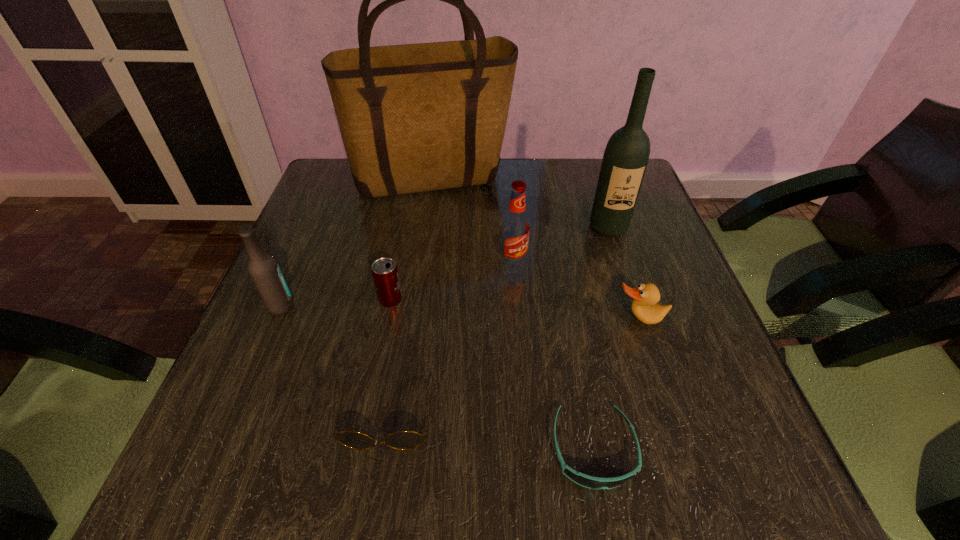
Where is `the right sunglasses`? This screenshot has width=960, height=540. the right sunglasses is located at coordinates (584, 480).

Find the location of a particular element. Image resolution: width=960 pixels, height=540 pixels. the sixth object from left to right is located at coordinates pos(584,480).

Identify the location of vacant region located on the front of the tote bag. The image size is (960, 540). (420, 270).

Image resolution: width=960 pixels, height=540 pixels. Identify the location of vacant space located 0.150m on the labeled side of the wine bottle. (627, 286).

Identify the location of vacant space located on the right of the third farthest object. This screenshot has width=960, height=540. (679, 264).

Where is `free region located 0.370m on the label of the leftmost object`? This screenshot has width=960, height=540. free region located 0.370m on the label of the leftmost object is located at coordinates (476, 306).

Where is `free region located 0.330m on the right of the beer can`? free region located 0.330m on the right of the beer can is located at coordinates (564, 300).

You are a GUI agent. You are given a task and a screenshot of the screen. Output one action in this format:
    pyautogui.click(x=<x>, y=<y>)
    Task: Click on the vacant space situated on the beak of the duck
    This screenshot has height=540, width=960.
    Given the screenshot: What is the action you would take?
    coord(659,377)

At what (x,y) coordinates should I click in order to perform the action: click on free space located on the lenses of the left sunglasses. Please return your answer as a coordinate pair (x, y). Looking at the image, I should click on (375, 494).

Locate an element on the screen. object present at the far edge is located at coordinates (420, 117).